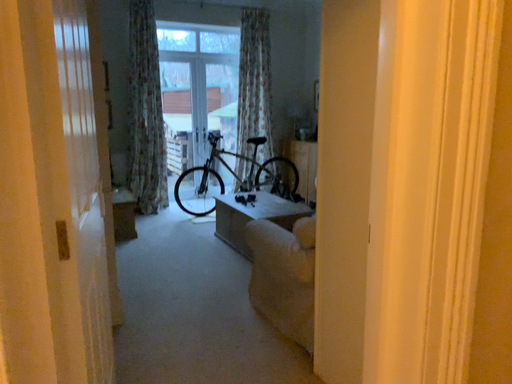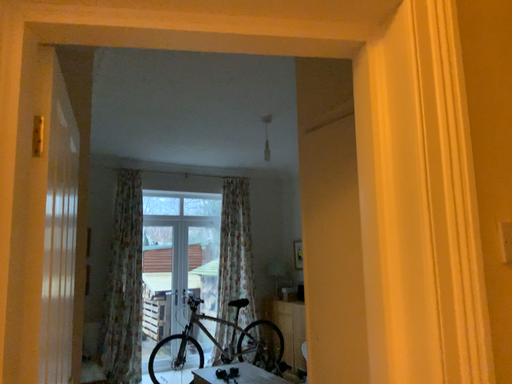
Question: How did the camera likely rotate when shooting the video?

Choices:
 (A) rotated downward
 (B) rotated upward

Answer: (B)